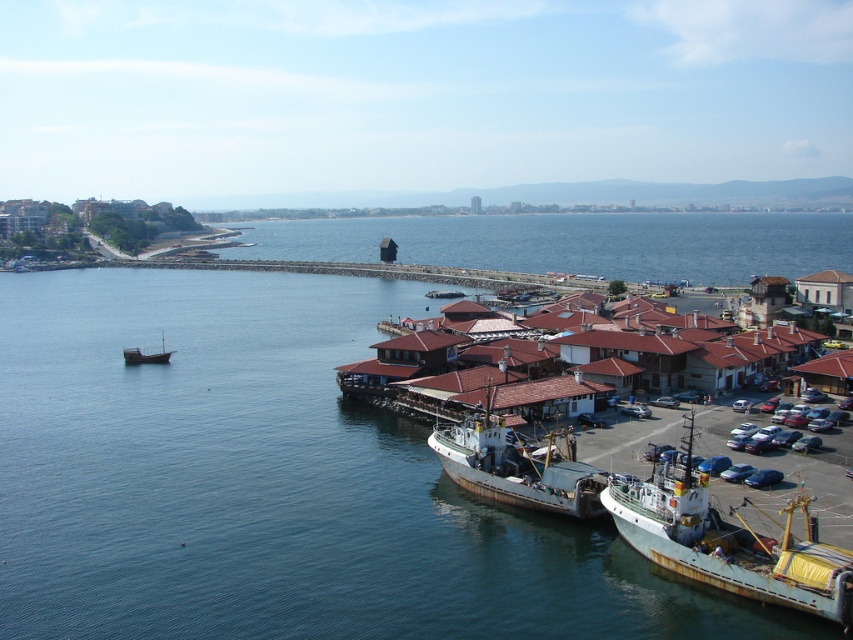
Question: Which of the following is the closest to the observer?

Choices:
 (A) (292, 448)
 (B) (126, 355)
 (C) (547, 468)

Answer: (C)

Question: Which of the following is the closest to the observer?

Choices:
 (A) (13, 612)
 (B) (566, 493)
 (C) (706, 536)
 (D) (125, 348)

Answer: (A)

Question: Can you confirm if blue water at center is positioned below wooden boat at left?

Choices:
 (A) no
 (B) yes

Answer: (B)

Question: Can you confirm if rusty metal ship at lower right is positioned above wooden boat at left?

Choices:
 (A) yes
 (B) no

Answer: (B)

Question: Based on their relative distances, which object is nearer to the rusty metal fishing boat at lower center?

Choices:
 (A) wooden boat at left
 (B) rusty metal ship at lower right
 (C) blue water at center

Answer: (B)

Question: Is blue water at center above rusty metal fishing boat at lower center?

Choices:
 (A) yes
 (B) no

Answer: (A)